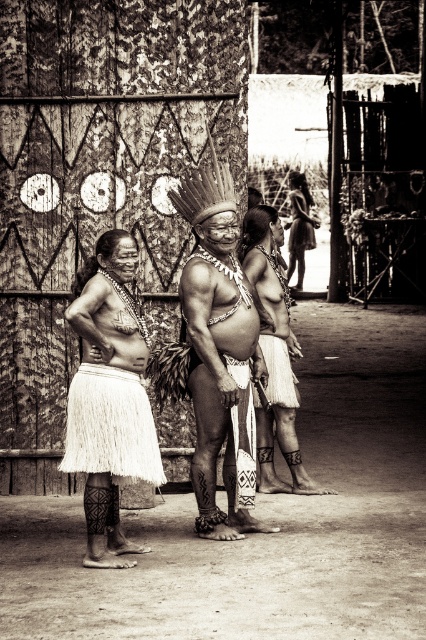
Based on the scene described, which object is larger in size between the smooth skin man at center and the white fringed skirt at left?

→ The smooth skin man at center is bigger than the white fringed skirt at left according to the description.